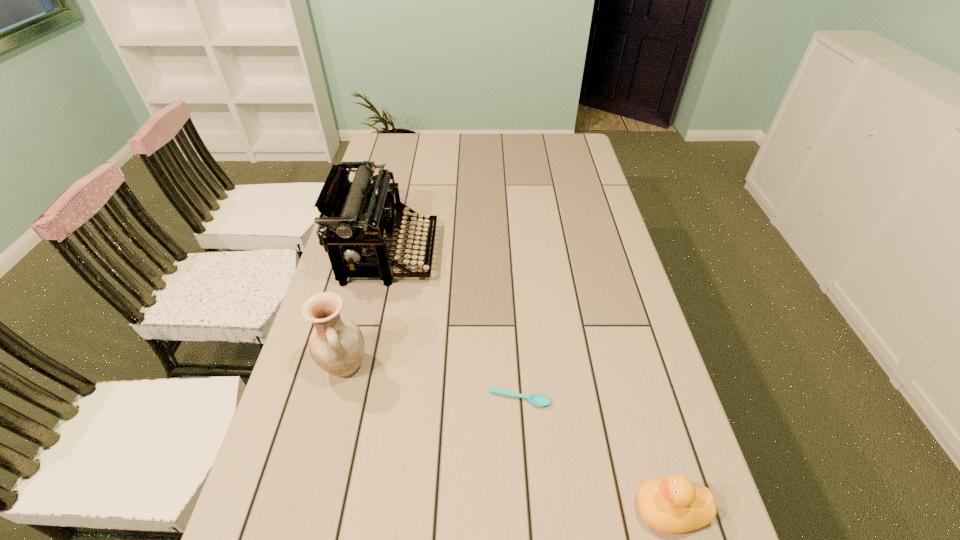
The width and height of the screenshot is (960, 540). What are the coordinates of `vacant space situated 0.180m on the face of the second shortest object` in the screenshot? It's located at (543, 509).

I want to click on vacant region located on the face of the second shortest object, so click(589, 509).

At what (x,y) coordinates should I click in order to perform the action: click on blank space located on the right of the spoon. Please return your answer as a coordinate pair (x, y). Looking at the image, I should click on (660, 399).

Image resolution: width=960 pixels, height=540 pixels. I want to click on typewriter that is at the left edge, so click(x=356, y=216).

The height and width of the screenshot is (540, 960). Find the location of `pottery at the left edge`. pottery at the left edge is located at coordinates (336, 344).

Find the location of `object that is positioned at the right edge`. object that is positioned at the right edge is located at coordinates (673, 505).

In the image, there is a desktop. Where is `vacant space at the far edge`? This screenshot has height=540, width=960. vacant space at the far edge is located at coordinates 423,149.

Image resolution: width=960 pixels, height=540 pixels. In order to click on free space at the right edge in this screenshot , I will do `click(628, 484)`.

Locate an element on the screen. This screenshot has height=540, width=960. vacant region at the far left corner is located at coordinates (388, 161).

The width and height of the screenshot is (960, 540). I want to click on vacant point located between the second object from right to left and the duck, so click(594, 454).